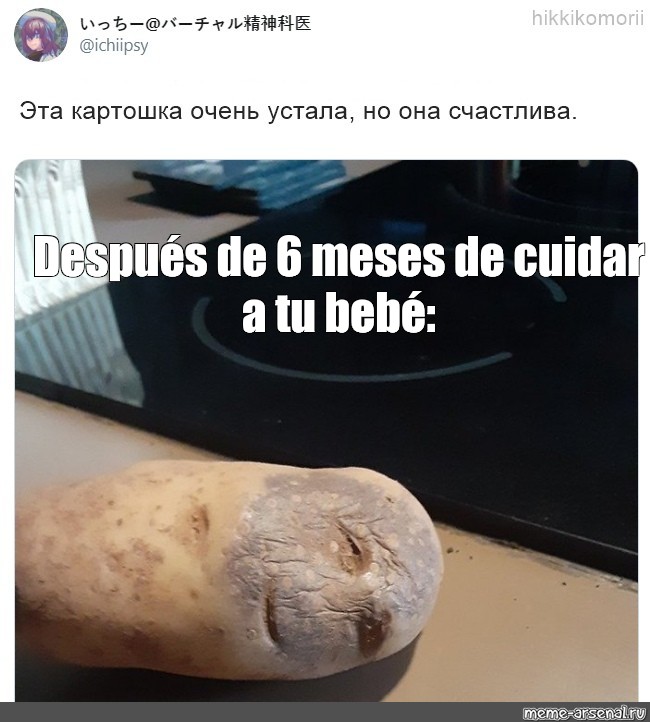
You are a GUI agent. You are given a task and a screenshot of the screen. Output one action in this format:
    pyautogui.click(x=<x>, y=<y>)
    Task: Click on the surface
    
    Given the screenshot: What is the action you would take?
    pyautogui.click(x=560, y=627)